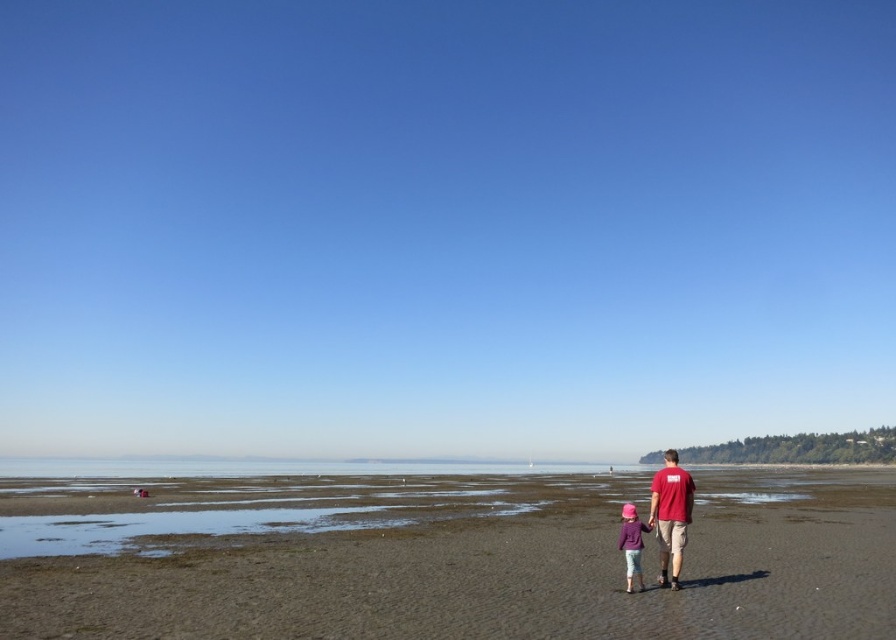
Question: Does matte red t-shirt at right lie behind pink fabric hat at lower center?

Choices:
 (A) yes
 (B) no

Answer: (A)

Question: Can you confirm if brown sandy beach at lower center is smaller than matte red t-shirt at right?

Choices:
 (A) no
 (B) yes

Answer: (A)

Question: Estimate the real-world distances between objects in this image. Which object is farther from the brown sandy beach at lower center?

Choices:
 (A) pink fabric hat at lower center
 (B) matte red t-shirt at right

Answer: (A)

Question: Which point is farther from the camera taking this photo?

Choices:
 (A) (634, 570)
 (B) (22, 620)

Answer: (A)

Question: Which point appears farthest from the camera in this image?

Choices:
 (A) (666, 563)
 (B) (625, 528)
 (C) (313, 621)

Answer: (A)

Question: Observing the image, what is the correct spatial positioning of brown sandy beach at lower center in reference to matte red t-shirt at right?

Choices:
 (A) below
 (B) above

Answer: (A)